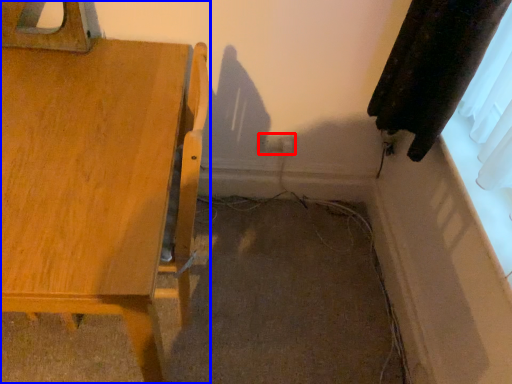
Question: Which object is closer to the camera taking this photo, electric outlet (highlighted by a red box) or furniture (highlighted by a blue box)?

Choices:
 (A) electric outlet
 (B) furniture

Answer: (B)